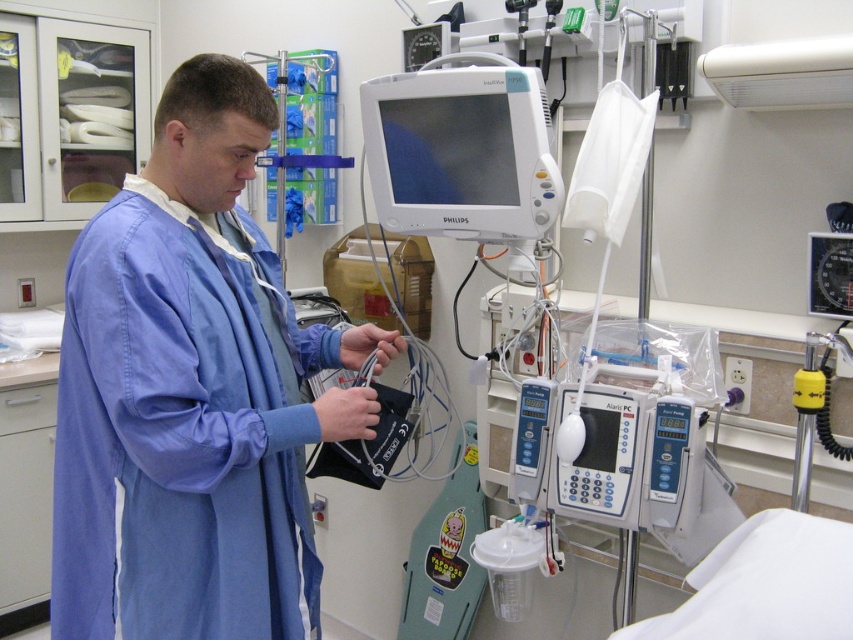
You are a nurse preparing to administer medication to a patient in the hospital room. You need to locate the blue cotton gown at center and the green plastic bag at center. From the perspective of someone standing at the head of the bed, which object is positioned to the left?

The blue cotton gown at center is to the left of the green plastic bag at center from the perspective of someone standing at the head of the bed.

You are a nurse in the hospital room. You need to locate two specific points marked in the scene. The first point is at coordinate point(207, 326) and the second is at point(463, 602). Which point is closer to you as you stand facing the medical equipment?

Point(207, 326) is in front of point(463, 602), so it is closer to you as you stand facing the medical equipment.

You are a medical technician who needs to move a medical tool from the white glossy monitor at center to the green plastic bag at center. The tool is 1.2 meters long. Can you move it without lifting it vertically? Please explain.

The distance between the white glossy monitor at center and the green plastic bag at center is 1.02 meters. Since the tool is 1.2 meters long, which is longer than the available space, you cannot move it horizontally without lifting it vertically.